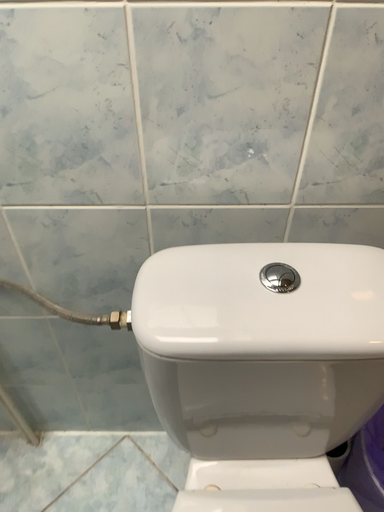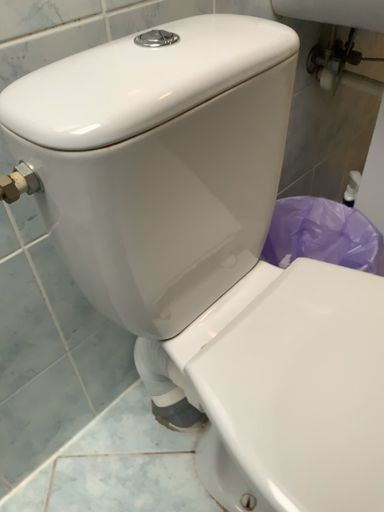
Question: How did the camera likely rotate when shooting the video?

Choices:
 (A) rotated right
 (B) rotated left

Answer: (A)